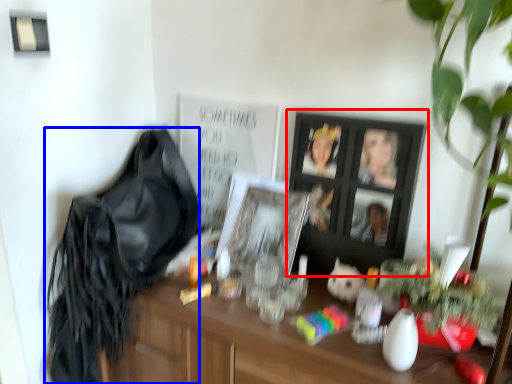
Question: Which object is closer to the camera taking this photo, picture frame (highlighted by a red box) or shoulder bag (highlighted by a blue box)?

Choices:
 (A) picture frame
 (B) shoulder bag

Answer: (B)